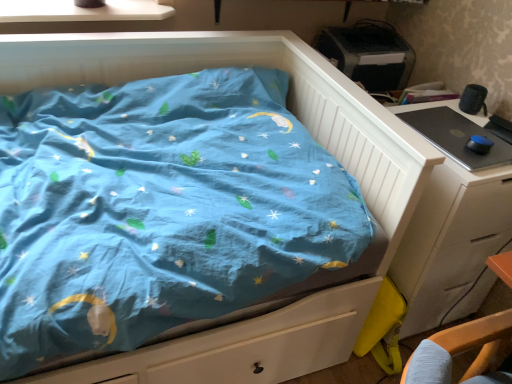
Image resolution: width=512 pixels, height=384 pixels. What do you see at coordinates (81, 11) in the screenshot?
I see `white glossy window sill at upper left` at bounding box center [81, 11].

Find the location of a particular element. This screenshot has height=384, width=512. white wood chest of drawers at right is located at coordinates (450, 239).

Measure the distance between point (417, 122) and camera.

4.36 feet.

The image size is (512, 384). Find the location of `black glossy desktop at right`. black glossy desktop at right is located at coordinates (457, 137).

This screenshot has width=512, height=384. In order to click on white glossy window sill at upper left in this screenshot , I will do [81, 11].

Is white glossy window sill at upper left taller or shorter than white wood chest of drawers at right?

In the image, white glossy window sill at upper left appears to be shorter than white wood chest of drawers at right.

From the image's perspective, between white glossy window sill at upper left and white wood chest of drawers at right, which one is located above?

white glossy window sill at upper left appears higher in the image.

Considering the relative sizes of white glossy window sill at upper left and white wood chest of drawers at right in the image provided, is white glossy window sill at upper left thinner than white wood chest of drawers at right?

Yes.

Is black glossy desktop at right not within white wood chest of drawers at right?

Indeed, black glossy desktop at right is completely outside white wood chest of drawers at right.

From the image's perspective, which one is positioned lower, black glossy desktop at right or white wood chest of drawers at right?

From the image's view, white wood chest of drawers at right is below.

Where is `desktop above the white wood chest of drawers at right (from a real-world perspective)`? desktop above the white wood chest of drawers at right (from a real-world perspective) is located at coordinates (457, 137).

Who is bigger, black glossy desktop at right or white wood chest of drawers at right?

Bigger between the two is white wood chest of drawers at right.

Does black glossy desktop at right lie behind white glossy window sill at upper left?

No, it is in front of white glossy window sill at upper left.

Find the location of a particular element. This screenshot has height=384, width=512. desktop lying in front of the white glossy window sill at upper left is located at coordinates (457, 137).

Is black glossy desktop at right aimed at white glossy window sill at upper left?

No, black glossy desktop at right is not turned towards white glossy window sill at upper left.

Can you tell me how much white wood chest of drawers at right and white glossy window sill at upper left differ in facing direction?

1.19 degrees separate the facing orientations of white wood chest of drawers at right and white glossy window sill at upper left.

Is white wood chest of drawers at right inside or outside of white glossy window sill at upper left?

white wood chest of drawers at right is not inside white glossy window sill at upper left, it's outside.

How far apart are white wood chest of drawers at right and white glossy window sill at upper left?

white wood chest of drawers at right and white glossy window sill at upper left are 1.33 meters apart from each other.

Is white wood chest of drawers at right turned away from white glossy window sill at upper left?

No, white wood chest of drawers at right is not facing away from white glossy window sill at upper left.

From a real-world perspective, is white wood chest of drawers at right physically below black glossy desktop at right?

Indeed, from a real-world perspective, white wood chest of drawers at right is positioned beneath black glossy desktop at right.

From the image's perspective, is white wood chest of drawers at right on black glossy desktop at right?

Incorrect, from the image's perspective, white wood chest of drawers at right is lower than black glossy desktop at right.

Can you confirm if white wood chest of drawers at right is positioned to the right of black glossy desktop at right?

Yes, white wood chest of drawers at right is to the right of black glossy desktop at right.

Consider the image. From a real-world perspective, which is physically below, white glossy window sill at upper left or black glossy desktop at right?

In real-world perspective, black glossy desktop at right is lower.

Based on their positions, is white glossy window sill at upper left located to the left or right of black glossy desktop at right?

Clearly, white glossy window sill at upper left is on the left of black glossy desktop at right in the image.

Does white glossy window sill at upper left have a larger size compared to black glossy desktop at right?

Indeed, white glossy window sill at upper left has a larger size compared to black glossy desktop at right.

The height and width of the screenshot is (384, 512). In order to click on window sill above the black glossy desktop at right (from a real-world perspective) in this screenshot , I will do `click(81, 11)`.

This screenshot has height=384, width=512. In order to click on the chest of drawers in front of the white glossy window sill at upper left in this screenshot , I will do `click(450, 239)`.

Locate an element on the screen. This screenshot has width=512, height=384. desktop lying on the left of white wood chest of drawers at right is located at coordinates (457, 137).

Estimate the real-world distances between objects in this image. Which object is closer to black glossy desktop at right, white wood chest of drawers at right or white glossy window sill at upper left?

Based on the image, white wood chest of drawers at right appears to be nearer to black glossy desktop at right.

From the image, which object appears to be nearer to white glossy window sill at upper left, white wood chest of drawers at right or black glossy desktop at right?

black glossy desktop at right is positioned closer to the anchor white glossy window sill at upper left.

Looking at the image, which one is located closer to white wood chest of drawers at right, white glossy window sill at upper left or black glossy desktop at right?

black glossy desktop at right lies closer to white wood chest of drawers at right than the other object.

Looking at the image, which one is located further to black glossy desktop at right, white glossy window sill at upper left or white wood chest of drawers at right?

Based on the image, white glossy window sill at upper left appears to be further to black glossy desktop at right.

When comparing their distances from white wood chest of drawers at right, does black glossy desktop at right or white glossy window sill at upper left seem closer?

Among the two, black glossy desktop at right is located nearer to white wood chest of drawers at right.

Considering their positions, is black glossy desktop at right positioned further to white glossy window sill at upper left than white wood chest of drawers at right?

Among the two, white wood chest of drawers at right is located further to white glossy window sill at upper left.

Where is `desktop between white glossy window sill at upper left and white wood chest of drawers at right in the horizontal direction`? Image resolution: width=512 pixels, height=384 pixels. desktop between white glossy window sill at upper left and white wood chest of drawers at right in the horizontal direction is located at coordinates [x=457, y=137].